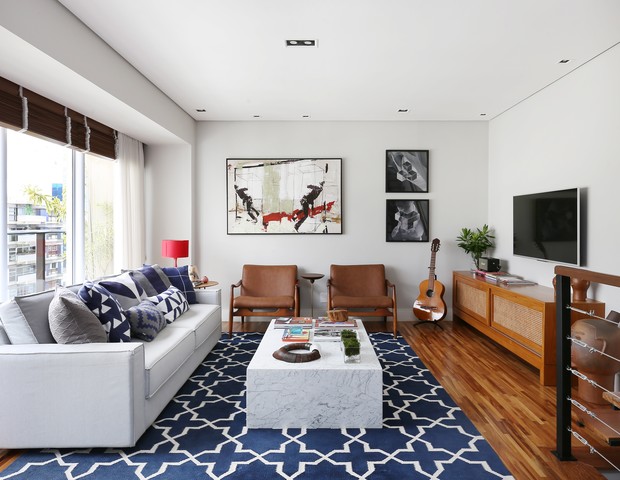
Identify the location of wires. The image size is (620, 480). (565, 357).